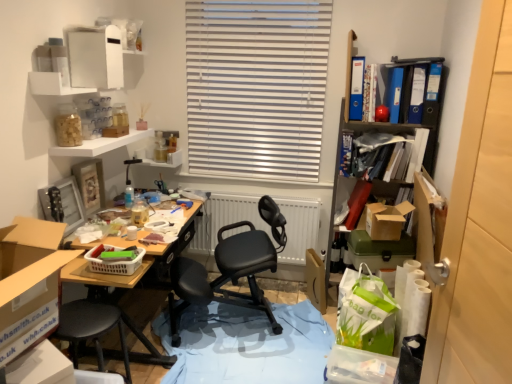
In order to face wooden screen door at right, should I rotate leftwards or rightwards?

Rotate right and turn 29.949 degrees.

The height and width of the screenshot is (384, 512). What are the coordinates of `matte red book at right, which appears as the 5th book when viewed from the right` in the screenshot? It's located at (357, 202).

This screenshot has height=384, width=512. Identify the location of translucent plastic shelf at upper left, positioned as the 2th shelf in back-to-front order. (100, 145).

This screenshot has height=384, width=512. In order to click on blue plastic ring binder at upper right, placed as the 6th book when sorted from right to left in this screenshot , I will do `click(356, 88)`.

Describe the element at coordinates (356, 88) in the screenshot. The height and width of the screenshot is (384, 512). I see `blue plastic ring binder at upper right, placed as the 6th book when sorted from right to left` at that location.

Identify the location of wooden screen door at right. The image size is (512, 384). (479, 224).

From the image's perspective, is white matte radiator at center located beneath brown cardboard box at right, acting as the 1th box starting from the back?

Yes, from the image's perspective, white matte radiator at center is below brown cardboard box at right, acting as the 1th box starting from the back.

From a real-world perspective, is white matte radiator at center over brown cardboard box at right, which is the second box in front-to-back order?

Actually, white matte radiator at center is physically below brown cardboard box at right, which is the second box in front-to-back order, in the real world.

Does point (294, 210) appear closer or farther from the camera than point (383, 207)?

Point (294, 210).

Considering their positions, is white matte radiator at center located in front of or behind brown cardboard box at right, which is the second box in front-to-back order?

white matte radiator at center is behind brown cardboard box at right, which is the second box in front-to-back order.

From a real-world perspective, is black leather office chair at center over matte blue book at upper right, the fourth book positioned from the right?

Actually, black leather office chair at center is physically below matte blue book at upper right, the fourth book positioned from the right, in the real world.

Is black leather office chair at center inside the boundaries of matte blue book at upper right, which is the 4th book in left-to-right order, or outside?

black leather office chair at center cannot be found inside matte blue book at upper right, which is the 4th book in left-to-right order.

Is black leather office chair at center not close to matte blue book at upper right, which is the 4th book in left-to-right order?

Yes, black leather office chair at center and matte blue book at upper right, which is the 4th book in left-to-right order, are quite far apart.

Is black leather office chair at center wider or thinner than matte blue book at upper right, which is the 4th book in left-to-right order?

Clearly, black leather office chair at center has more width compared to matte blue book at upper right, which is the 4th book in left-to-right order.

From a real-world perspective, does translucent plastic shelf at upper left, positioned as the 2th shelf in back-to-front order, sit lower than plastic basket at center?

Actually, translucent plastic shelf at upper left, positioned as the 2th shelf in back-to-front order, is physically above plastic basket at center in the real world.

Which of these two, translucent plastic shelf at upper left, arranged as the 2th shelf when viewed from the front, or plastic basket at center, is smaller?

plastic basket at center is smaller.

Considering the sizes of objects translucent plastic shelf at upper left, positioned as the 2th shelf in back-to-front order, and plastic basket at center in the image provided, who is shorter, translucent plastic shelf at upper left, positioned as the 2th shelf in back-to-front order, or plastic basket at center?

Standing shorter between the two is translucent plastic shelf at upper left, positioned as the 2th shelf in back-to-front order.

How much distance is there between translucent plastic shelf at upper left, arranged as the 2th shelf when viewed from the front, and plastic basket at center?

translucent plastic shelf at upper left, arranged as the 2th shelf when viewed from the front, is 29.21 inches away from plastic basket at center.

From a real-world perspective, which object stands above the other?

cardboard box at left, the 1th box viewed from the front, is physically above.

Considering the positions of points (10, 253) and (177, 161), is point (10, 253) farther from camera compared to point (177, 161)?

That is False.

Could you tell me if cardboard box at left, which appears as the second box when viewed from the right, is turned towards matte plastic container at upper center, the first shelf in the back-to-front sequence?

No.

From the picture: From the image's perspective, which is below, cardboard box at left, the 1th box viewed from the front, or matte plastic container at upper center, placed as the third shelf when sorted from front to back?

cardboard box at left, the 1th box viewed from the front, appears lower in the image.

How many degrees apart are the facing directions of translucent plastic shelf at upper left, positioned as the 2th shelf in back-to-front order, and white plastic shelf at upper left, which is counted as the 3th shelf, starting from the back?

0.044 degrees separate the facing orientations of translucent plastic shelf at upper left, positioned as the 2th shelf in back-to-front order, and white plastic shelf at upper left, which is counted as the 3th shelf, starting from the back.

Can we say translucent plastic shelf at upper left, arranged as the 2th shelf when viewed from the front, lies outside white plastic shelf at upper left, which appears as the first shelf when viewed from the front?

Absolutely, translucent plastic shelf at upper left, arranged as the 2th shelf when viewed from the front, is external to white plastic shelf at upper left, which appears as the first shelf when viewed from the front.

Consider the image. Between translucent plastic shelf at upper left, positioned as the 2th shelf in back-to-front order, and white plastic shelf at upper left, which is counted as the 3th shelf, starting from the back, which one is positioned in front?

white plastic shelf at upper left, which is counted as the 3th shelf, starting from the back.

Is translucent plastic shelf at upper left, arranged as the 2th shelf when viewed from the front, far away from white plastic shelf at upper left, which is counted as the 3th shelf, starting from the back?

No, translucent plastic shelf at upper left, arranged as the 2th shelf when viewed from the front, is in close proximity to white plastic shelf at upper left, which is counted as the 3th shelf, starting from the back.

Considering the relative sizes of wooden screen door at right and translucent plastic shelf at upper left, positioned as the 2th shelf in back-to-front order, in the image provided, is wooden screen door at right smaller than translucent plastic shelf at upper left, positioned as the 2th shelf in back-to-front order,?

Incorrect, wooden screen door at right is not smaller in size than translucent plastic shelf at upper left, positioned as the 2th shelf in back-to-front order.

Is wooden screen door at right completely or partially outside of translucent plastic shelf at upper left, positioned as the 2th shelf in back-to-front order?

Indeed, wooden screen door at right is completely outside translucent plastic shelf at upper left, positioned as the 2th shelf in back-to-front order.

Could you tell me if wooden screen door at right is turned towards translucent plastic shelf at upper left, arranged as the 2th shelf when viewed from the front?

No, wooden screen door at right is not turned towards translucent plastic shelf at upper left, arranged as the 2th shelf when viewed from the front.

Between wooden screen door at right and translucent plastic shelf at upper left, arranged as the 2th shelf when viewed from the front, which one has smaller width?

wooden screen door at right is thinner.

Looking at the image, does blue matte book at upper right, acting as the 1th book starting from the left, seem bigger or smaller compared to black leather office chair at center?

blue matte book at upper right, acting as the 1th book starting from the left, is smaller than black leather office chair at center.

Find the location of `chair that appears below the blue matte book at upper right, acting as the 1th book starting from the left (from the image's perspective)`. chair that appears below the blue matte book at upper right, acting as the 1th book starting from the left (from the image's perspective) is located at coordinates (231, 269).

Is blue matte book at upper right, acting as the 1th book starting from the left, to the left or to the right of black leather office chair at center in the image?

blue matte book at upper right, acting as the 1th book starting from the left, is to the right of black leather office chair at center.

Which is less distant, (350, 132) or (211, 289)?

The point (350, 132) is in front.

Which box is the 1st one when counting from the front of the white matte radiator at center? Please provide its 2D coordinates.

[(386, 220)]

This screenshot has height=384, width=512. In order to click on chair that is under the matte blue book at upper right, which is the 4th book in left-to-right order (from a real-world perspective) in this screenshot , I will do tap(231, 269).

Considering their positions, is matte blue book at upper right, which is the 4th book in left-to-right order, positioned closer to matte plastic container at upper center, the first shelf in the back-to-front sequence, than blue plastic ring binder at upper right, placed as the 6th book when sorted from right to left?

blue plastic ring binder at upper right, placed as the 6th book when sorted from right to left, lies closer to matte plastic container at upper center, the first shelf in the back-to-front sequence, than the other object.

From the image, which object appears to be farther from translucent plastic shelf at upper left, arranged as the 2th shelf when viewed from the front, cardboard at center or brown cardboard box at right, the second box viewed from the left?

brown cardboard box at right, the second box viewed from the left, is further to translucent plastic shelf at upper left, arranged as the 2th shelf when viewed from the front.

Estimate the real-world distances between objects in this image. Which object is further from blue glossy file at upper right, which is the 2th book in right-to-left order, blue matte book at upper right, acting as the 1th book starting from the left, or wooden screen door at right?

wooden screen door at right lies further to blue glossy file at upper right, which is the 2th book in right-to-left order, than the other object.

Estimate the real-world distances between objects in this image. Which object is further from brown cardboard box at right, which is the second box in front-to-back order, black leather office chair at center or white matte radiator at center?

black leather office chair at center is positioned further to the anchor brown cardboard box at right, which is the second box in front-to-back order.

Considering their positions, is blue glossy file at upper right, which is counted as the fifth book, starting from the left, positioned further to brown cardboard box at right, which is the second box in front-to-back order, than white plastic shelf at upper left, which is counted as the 3th shelf, starting from the back?

white plastic shelf at upper left, which is counted as the 3th shelf, starting from the back, is further to brown cardboard box at right, which is the second box in front-to-back order.

Looking at the image, which one is located further to blue plastic ring binder at upper right, placed as the second book when sorted from left to right, white matte radiator at center or brown cardboard box at right, the second box viewed from the left?

Among the two, white matte radiator at center is located further to blue plastic ring binder at upper right, placed as the second book when sorted from left to right.

Consider the image. When comparing their distances from matte red book at right, placed as the third book when sorted from left to right, does white matte radiator at center or black leather office chair at center seem closer?

Among the two, white matte radiator at center is located nearer to matte red book at right, placed as the third book when sorted from left to right.

Estimate the real-world distances between objects in this image. Which object is closer to matte blue book at upper right, which is the 4th book in left-to-right order, white plastic shelf at upper left, which appears as the first shelf when viewed from the front, or wooden screen door at right?

white plastic shelf at upper left, which appears as the first shelf when viewed from the front.

Locate an element on the screen. The width and height of the screenshot is (512, 384). cardboard box between matte plastic container at upper center, the first shelf in the back-to-front sequence, and blue matte folder at upper right, arranged as the 1th book when viewed from the right, in the horizontal direction is located at coordinates (315, 280).

The height and width of the screenshot is (384, 512). Find the location of `cardboard box situated between white matte radiator at center and brown cardboard box at right, the second box viewed from the left, from left to right`. cardboard box situated between white matte radiator at center and brown cardboard box at right, the second box viewed from the left, from left to right is located at coordinates (315, 280).

Locate an element on the screen. This screenshot has width=512, height=384. box located between wooden screen door at right and brown cardboard box at right, the second box viewed from the left, in the depth direction is located at coordinates [x=28, y=317].

Identify the location of basket positioned between wooden screen door at right and white matte radiator at center from near to far. Image resolution: width=512 pixels, height=384 pixels. (113, 261).